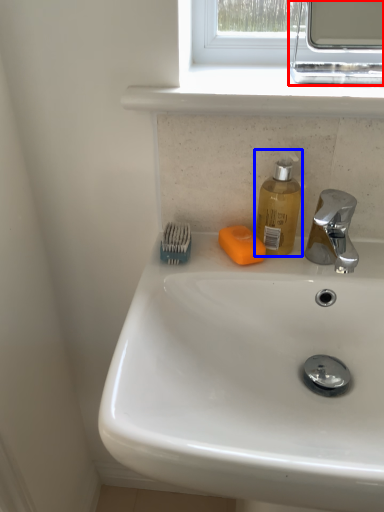
Question: Among these objects, which one is farthest to the camera, medicine cabinet (highlighted by a red box) or soap dispenser (highlighted by a blue box)?

Choices:
 (A) medicine cabinet
 (B) soap dispenser

Answer: (B)